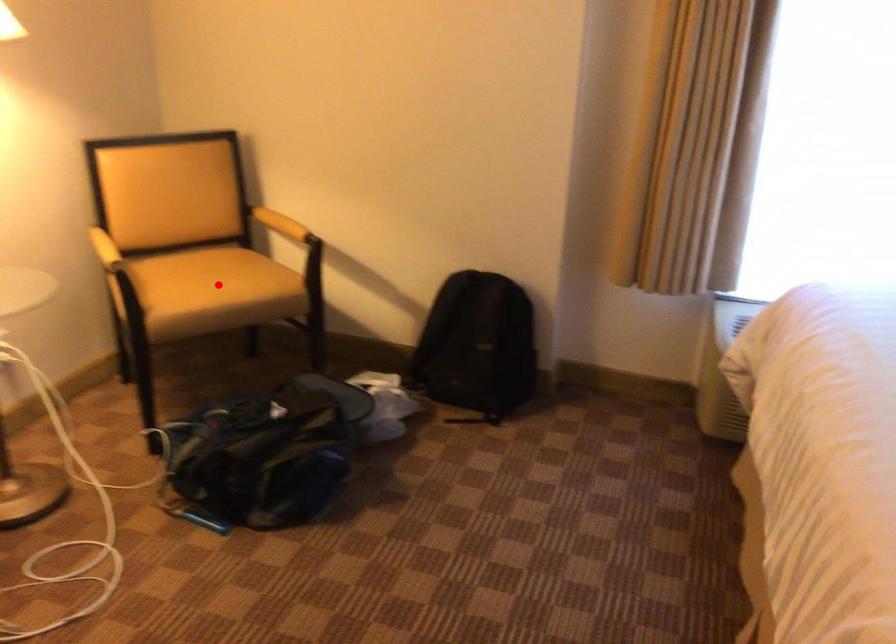
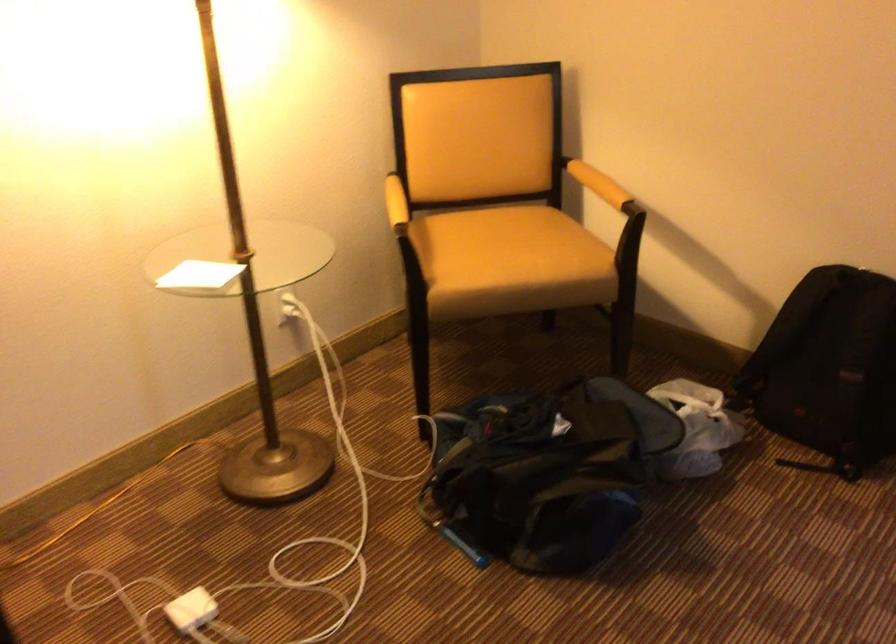
Question: I am providing you with two images of the same scene from different viewpoints. A red point is shown in image1. For the corresponding object point in image2, is it positioned nearer or farther from the camera?

Choices:
 (A) Nearer
 (B) Farther

Answer: (A)